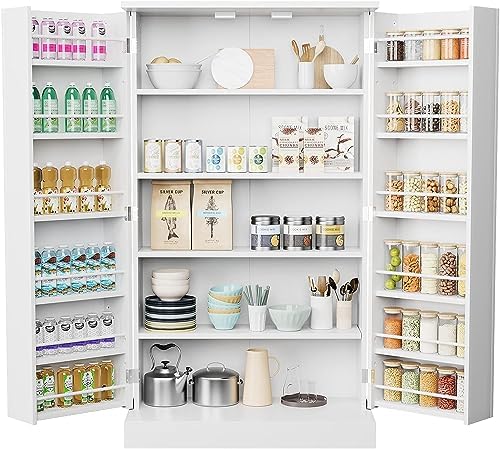
Locate an element on the screen. glass jars on the sixth shelf is located at coordinates (461, 391), (446, 384), (427, 383), (411, 381), (389, 377).